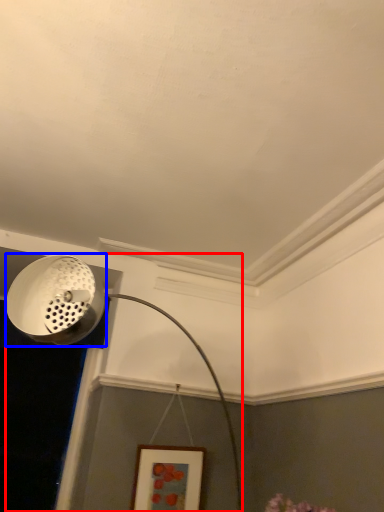
Question: Which of the following is the closest to the observer, lamp (highlighted by a red box) or light fixture (highlighted by a blue box)?

Choices:
 (A) lamp
 (B) light fixture

Answer: (A)